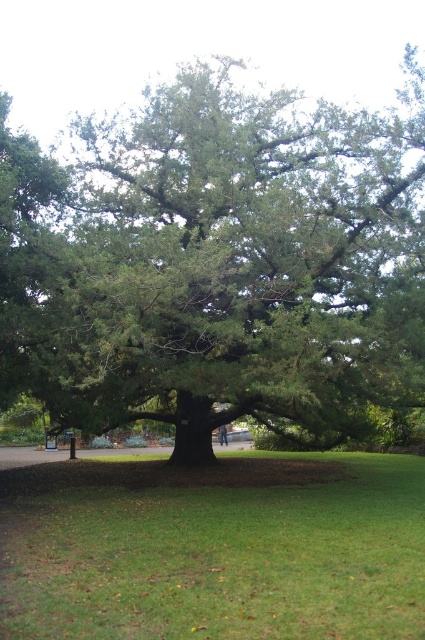
Question: Which point appears farthest from the camera in this image?

Choices:
 (A) (59, 536)
 (B) (277, 413)

Answer: (B)

Question: Is green leafy tree at center wider than green grass at center?

Choices:
 (A) yes
 (B) no

Answer: (A)

Question: Which point is closer to the camera?

Choices:
 (A) green leafy tree at center
 (B) green grass at center

Answer: (B)

Question: Does green leafy tree at center have a greater width compared to green grass at center?

Choices:
 (A) no
 (B) yes

Answer: (B)

Question: Does green leafy tree at center lie behind green grass at center?

Choices:
 (A) yes
 (B) no

Answer: (A)

Question: Which point is closer to the camera taking this photo?

Choices:
 (A) coord(107,512)
 (B) coord(82,397)

Answer: (A)